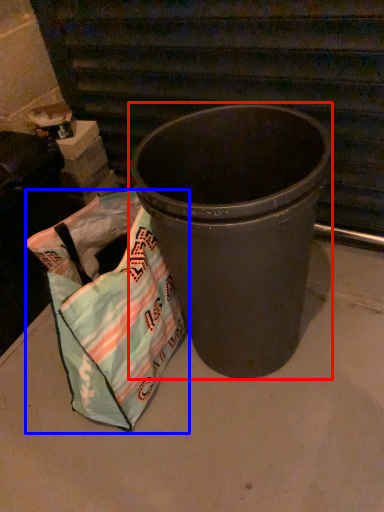
Question: Which of the following is the farthest to the observer, waste container (highlighted by a red box) or grocery bag (highlighted by a blue box)?

Choices:
 (A) waste container
 (B) grocery bag

Answer: (B)